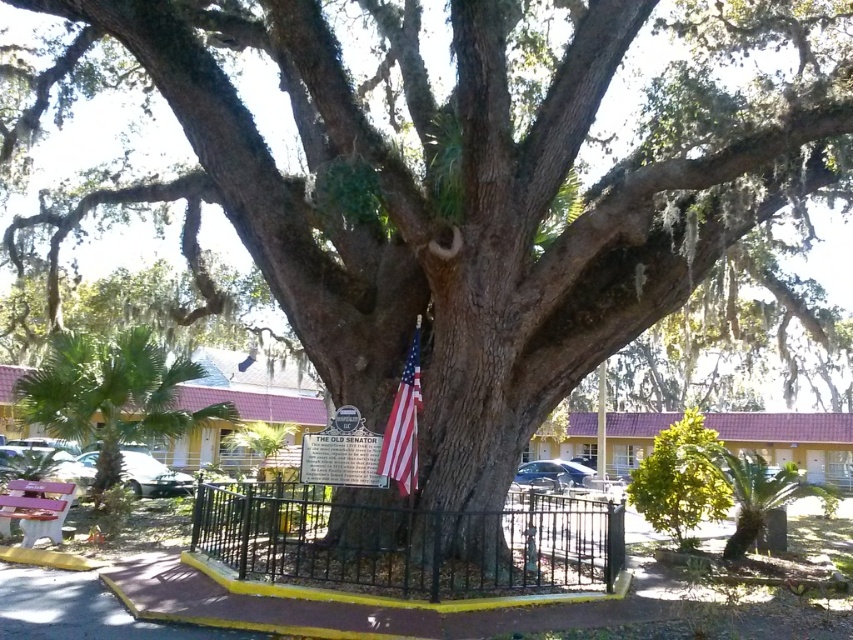
Question: Does green leafy palm tree at lower left come behind matte pink wood bench at lower left?

Choices:
 (A) no
 (B) yes

Answer: (B)

Question: Which point appears farthest from the camera in this image?

Choices:
 (A) (18, 502)
 (B) (405, 486)
 (C) (68, 353)

Answer: (C)

Question: Which object appears farthest from the camera in this image?

Choices:
 (A) green leafy bush at center
 (B) green leafy palm at lower right
 (C) black wrought iron fence at center
 (D) matte pink wood bench at lower left

Answer: (A)

Question: Estimate the real-world distances between objects in this image. Which object is closer to the green leafy palm at lower right?

Choices:
 (A) american flag at center
 (B) green leafy bush at center
 (C) black wrought iron fence at center
 (D) green leafy palm tree at lower left

Answer: (B)

Question: Does black wrought iron fence at center have a larger size compared to green leafy palm at lower right?

Choices:
 (A) no
 (B) yes

Answer: (A)

Question: Does black wrought iron fence at center have a lesser width compared to green leafy palm tree at lower left?

Choices:
 (A) no
 (B) yes

Answer: (A)